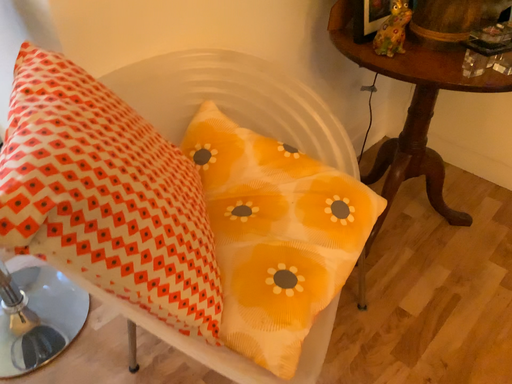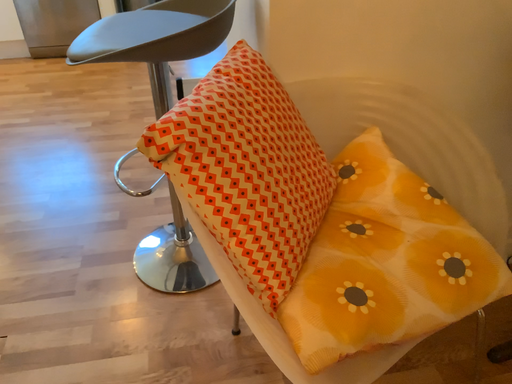
Question: How did the camera likely rotate when shooting the video?

Choices:
 (A) rotated downward
 (B) rotated upward

Answer: (B)